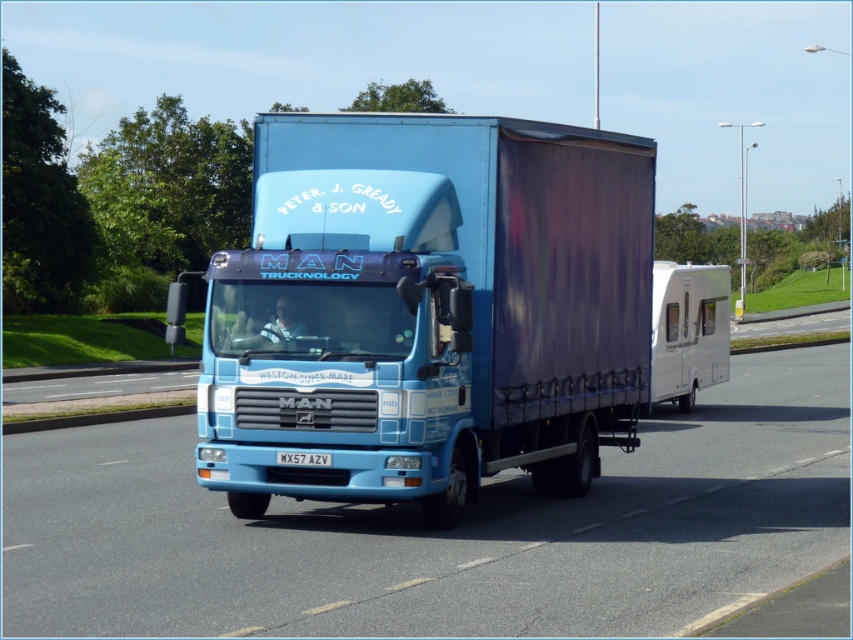
Question: Estimate the real-world distances between objects in this image. Which object is closer to the blue glossy truck at center?

Choices:
 (A) white glossy caravan at right
 (B) white plastic license plate at center
 (C) blue glossy trailer truck at center

Answer: (B)

Question: Is blue glossy trailer truck at center positioned at the back of white glossy caravan at right?

Choices:
 (A) yes
 (B) no

Answer: (B)

Question: Does blue glossy truck at center have a larger size compared to white glossy caravan at right?

Choices:
 (A) no
 (B) yes

Answer: (A)

Question: Which object is farther from the camera taking this photo?

Choices:
 (A) blue glossy truck at center
 (B) blue glossy trailer truck at center
 (C) white glossy caravan at right
 (D) white plastic license plate at center

Answer: (C)

Question: Is blue glossy truck at center to the left of white glossy caravan at right from the viewer's perspective?

Choices:
 (A) yes
 (B) no

Answer: (A)

Question: Which of the following is the farthest from the observer?

Choices:
 (A) white plastic license plate at center
 (B) blue glossy trailer truck at center
 (C) white glossy caravan at right

Answer: (C)